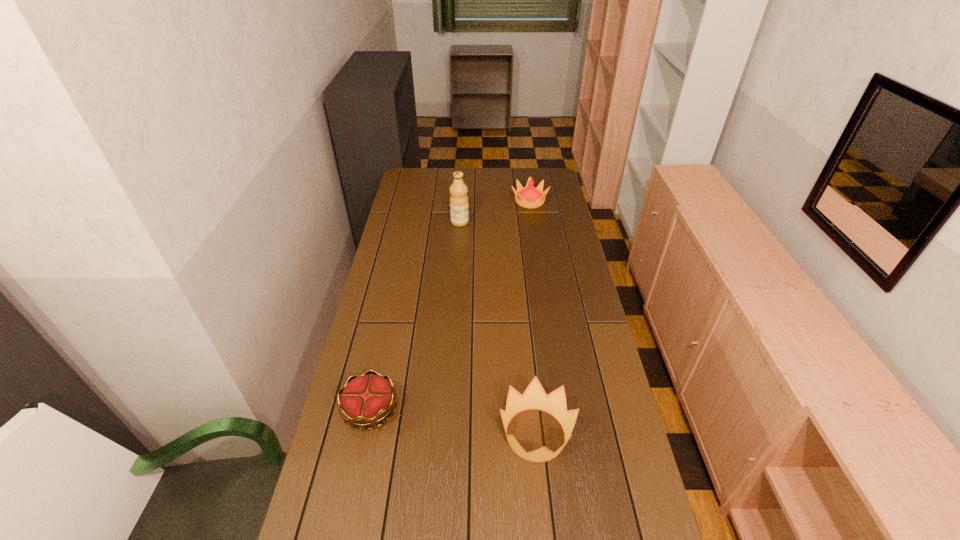
In order to click on object at the far right corner in this screenshot , I will do `click(529, 197)`.

What are the coordinates of `vacant space at the far edge` in the screenshot? It's located at (511, 169).

This screenshot has width=960, height=540. In order to click on free point at the left edge in this screenshot , I will do `click(401, 322)`.

In order to click on vacant space at the right edge of the desktop in this screenshot , I will do `click(555, 280)`.

At what (x,y) coordinates should I click in order to perform the action: click on blank area at the far left corner. Please return your answer as a coordinate pair (x, y). Image resolution: width=960 pixels, height=540 pixels. Looking at the image, I should click on (406, 172).

In order to click on empty space that is in between the shortest crown and the tallest object in this screenshot , I will do `click(415, 316)`.

Identify the location of free area in between the leftmost object and the tallest object. This screenshot has height=540, width=960. (415, 316).

The height and width of the screenshot is (540, 960). I want to click on blank region between the shortest object and the farthest object, so click(x=450, y=306).

Locate an element on the screen. This screenshot has height=540, width=960. empty location between the farthest object and the leftmost crown is located at coordinates click(450, 306).

Where is `vacant space that is in between the third object from right to left and the shortest crown`? The height and width of the screenshot is (540, 960). vacant space that is in between the third object from right to left and the shortest crown is located at coordinates (415, 316).